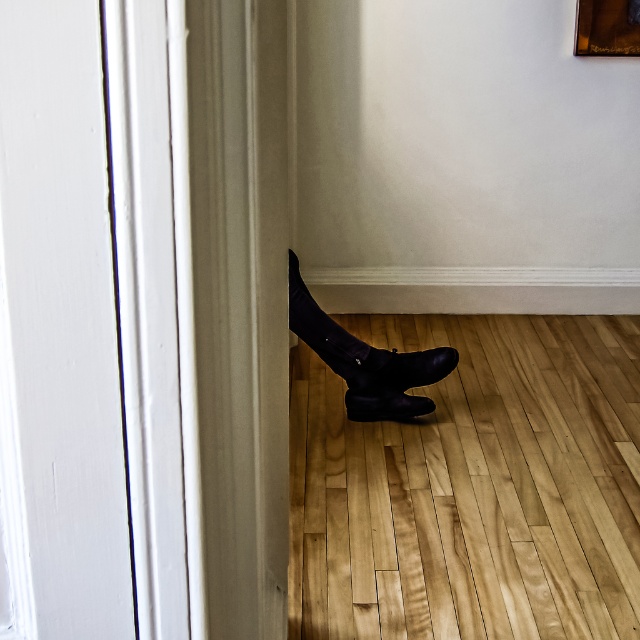
You are a furniture designer trying to place a new shelf between the black leather shoe at lower center and the wooden picture frame at upper right. Based on their sizes, will the shelf fit if it needs to be as tall as the taller object?

The wooden picture frame at upper right is taller than the black leather shoe at lower center. Therefore, the shelf needs to be as tall as the wooden picture frame at upper right to fit properly.

You are an interior designer planning to place a decorative rug in the room. The rug must be placed such that it does not interfere with the black suede boot at lower right. Given that the boot is located at coordinates point 0.542, 0.562, where should the rug be placed to avoid overlapping with the boot?

The rug should be placed away from the coordinates point (358, 346) to avoid overlapping with the black suede boot at lower right.

You are a photographer setting up a shoot in this room. You need to position a small tripod between the black leather shoe at lower center and the black suede boot at lower center. Is there enough vertical space between them to place the tripod?

The black leather shoe at lower center is located above the black suede boot at lower center, so there is vertical space between them. However, the exact height isn generated in the description, so it is uncertain if the tripod will fit.